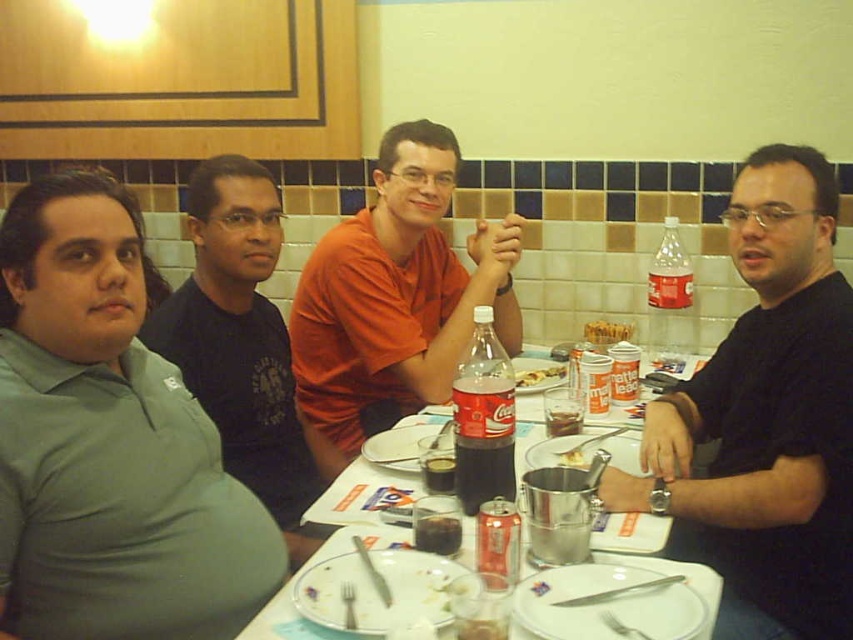
Is point (128, 465) in front of point (550, 369)?

Yes.

Does green matte shirt at left have a smaller size compared to yellowish matte plate at center?

Incorrect, green matte shirt at left is not smaller in size than yellowish matte plate at center.

Does point (1, 509) come farther from viewer compared to point (544, 372)?

No.

Where is `green matte shirt at left`? green matte shirt at left is located at coordinates (109, 442).

Is green matte shirt at left smaller than white porcelain bowl at center?

No, green matte shirt at left is not smaller than white porcelain bowl at center.

Based on the photo, is green matte shirt at left thinner than white porcelain bowl at center?

No, green matte shirt at left is not thinner than white porcelain bowl at center.

Is point (15, 273) in front of point (577, 461)?

Yes, point (15, 273) is closer to viewer.

Locate an element on the screen. green matte shirt at left is located at coordinates (109, 442).

Who is shorter, green matte shirt at left or gray cotton shirt at left?

With less height is green matte shirt at left.

Does green matte shirt at left have a larger size compared to gray cotton shirt at left?

No, green matte shirt at left is not bigger than gray cotton shirt at left.

Identify the location of green matte shirt at left. This screenshot has height=640, width=853. (109, 442).